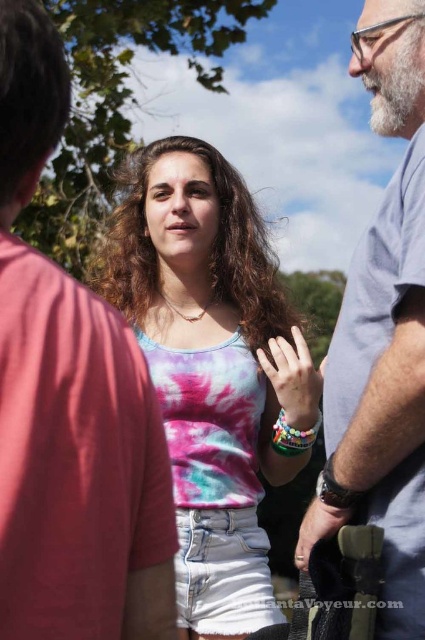
Question: Estimate the real-world distances between objects in this image. Which object is farther from the tie-dye fabric tank top at center?

Choices:
 (A) matte pink fabric at center
 (B) gray fabric shirt at right
 (C) matte black watch at center
 (D) gray fabric shirt at center

Answer: (D)

Question: Which point appears closest to the camera in this image?

Choices:
 (A) (303, 557)
 (B) (87, 349)
 (C) (252, 372)

Answer: (B)

Question: Does gray fabric shirt at right have a lesser width compared to matte pink fabric at center?

Choices:
 (A) no
 (B) yes

Answer: (A)

Question: Is tie-dye fabric tank top at center to the right of matte pink fabric at center from the viewer's perspective?

Choices:
 (A) no
 (B) yes

Answer: (A)

Question: Among these objects, which one is farthest from the camera?

Choices:
 (A) gray fabric shirt at center
 (B) matte pink fabric at center
 (C) matte black watch at center

Answer: (B)

Question: Is matte pink fabric at center wider than matte black watch at center?

Choices:
 (A) no
 (B) yes

Answer: (B)